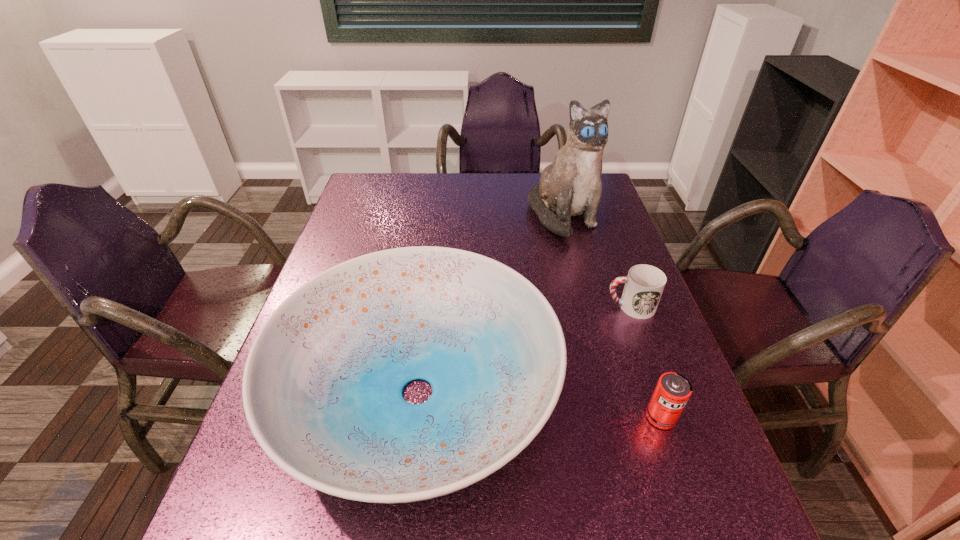
Find the location of `free point between the cat and the cup`. free point between the cat and the cup is located at coordinates (596, 261).

Identify the location of empty space that is in between the can and the farthest object. (612, 316).

The width and height of the screenshot is (960, 540). Find the location of `vacant area that lies between the cup and the can`. vacant area that lies between the cup and the can is located at coordinates (645, 362).

Where is `free space between the can and the cup`? free space between the can and the cup is located at coordinates (645, 362).

Identify which object is the third nearest to the dish. Please provide its 2D coordinates. Your answer should be formatted as a tuple, i.e. [(x, y)], where the tuple contains the x and y coordinates of a point satisfying the conditions above.

[(570, 186)]

I want to click on object that is the second nearest to the cup, so click(x=570, y=186).

Locate an element on the screen. vacant area that satisfies the following two spatial constraints: 1. at the face of the tallest object; 2. on the handle side of the cup is located at coordinates (587, 307).

Identify the location of vacant region that satisfies the following two spatial constraints: 1. at the face of the tallest object; 2. on the handle side of the cup. Image resolution: width=960 pixels, height=540 pixels. (587, 307).

At what (x,y) coordinates should I click in order to perform the action: click on blank space that satisfies the following two spatial constraints: 1. at the face of the can; 2. on the right side of the cat. Please return your answer as a coordinate pair (x, y). Looking at the image, I should click on (614, 417).

The image size is (960, 540). I want to click on free space that satisfies the following two spatial constraints: 1. on the back side of the can; 2. on the handle side of the cup, so click(623, 307).